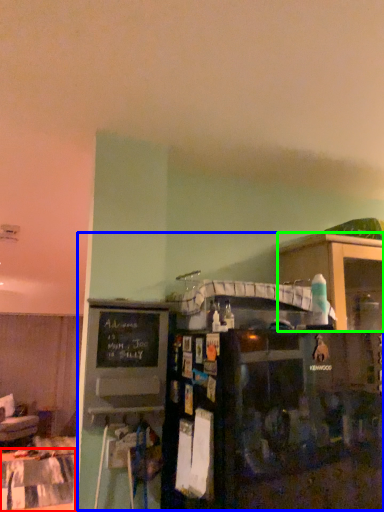
Question: Considering the real-world distances, which object is farthest from table (highlighted by a red box)? entertainment center (highlighted by a blue box) or shelf (highlighted by a green box)?

Choices:
 (A) entertainment center
 (B) shelf

Answer: (B)